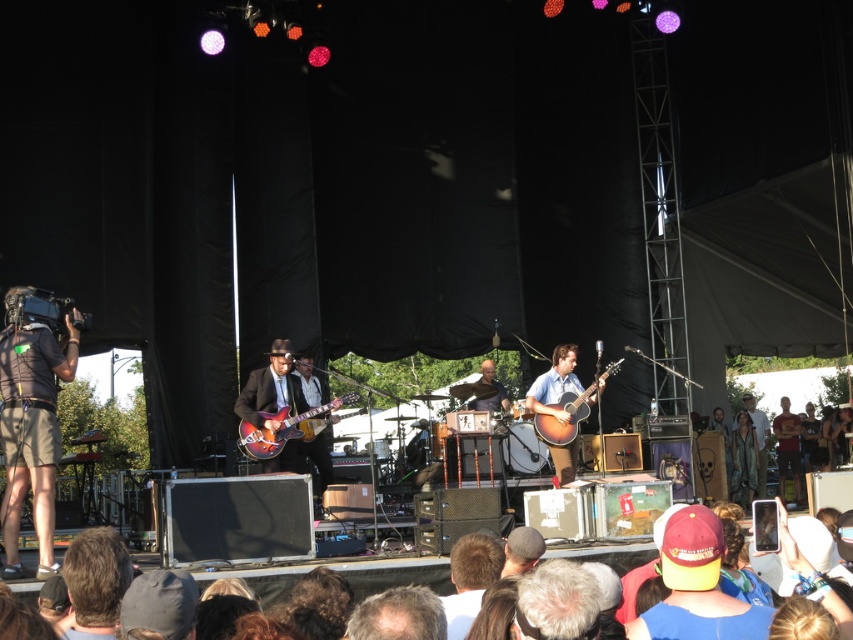
Can you confirm if glossy wood electric guitar at center is taller than light brown leather jacket at center?

In fact, glossy wood electric guitar at center may be shorter than light brown leather jacket at center.

Is point (254, 438) behind point (757, 413)?

No, it is in front of (757, 413).

Who is more forward, (297, 436) or (759, 454)?

Point (297, 436) is in front.

Locate an element on the screen. The width and height of the screenshot is (853, 640). glossy wood electric guitar at center is located at coordinates (286, 428).

Between black fabric camera at left and acoustic wood guitar at center, which one is positioned lower?

black fabric camera at left is lower down.

Is black fabric camera at left thinner than acoustic wood guitar at center?

Indeed, black fabric camera at left has a lesser width compared to acoustic wood guitar at center.

Who is more distant from viewer, (55, 376) or (608, 372)?

Positioned behind is point (608, 372).

This screenshot has width=853, height=640. What are the coordinates of `black fabric camera at left` in the screenshot? It's located at (32, 429).

Is point (704, 636) behind point (575, 412)?

No, it is in front of (575, 412).

Can you confirm if maroon fabric cap at lower right is wider than acoustic wood guitar at center?

Incorrect, maroon fabric cap at lower right's width does not surpass acoustic wood guitar at center's.

Locate an element on the screen. maroon fabric cap at lower right is located at coordinates (697, 586).